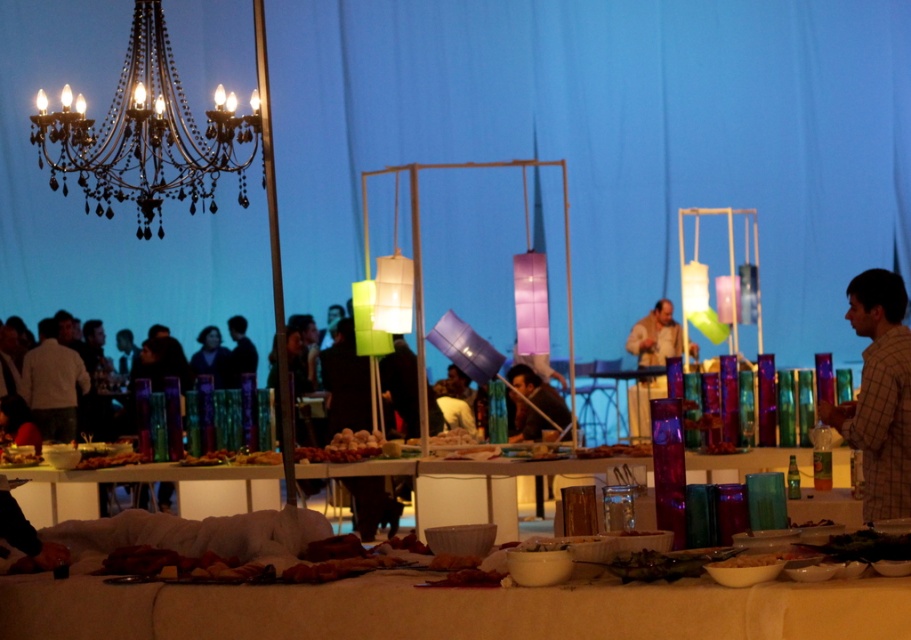
You are a guest at the event and want to take a photo of the black crystal chandelier at upper left and the translucent glass jars at center. Which object should you focus on first if you want to capture both in one frame without moving the camera?

The black crystal chandelier at upper left is smaller in size compared to the translucent glass jars at center, so you should focus on the translucent glass jars at center first to ensure they are in clear view before adjusting the camera settings for the smaller chandelier.

You are standing at the entrance of the event and want to reach the white matte table at lower center. Based on its coordinates, can you estimate how far it is from the entrance?

The white matte table at lower center is located at coordinates point (449, 609), which suggests it is positioned near the center of the image. Since the entrance is typically at the edge, it would likely be a moderate distance away, but without scale reference, an exact measurement cannot be provided.

Looking at this image, you are a server at the event and need to deliver a drink to the guest seated at the white glossy bowl at center. You are currently standing at the white matte table at lower center. Considering the distance between them, can you walk directly to the bowl without needing to detour around any obstacles?

The distance between the white matte table at lower center and the white glossy bowl at center is 8.82 meters. Since there is no mention of obstacles in the scene description, you can walk directly to the bowl without needing to detour.